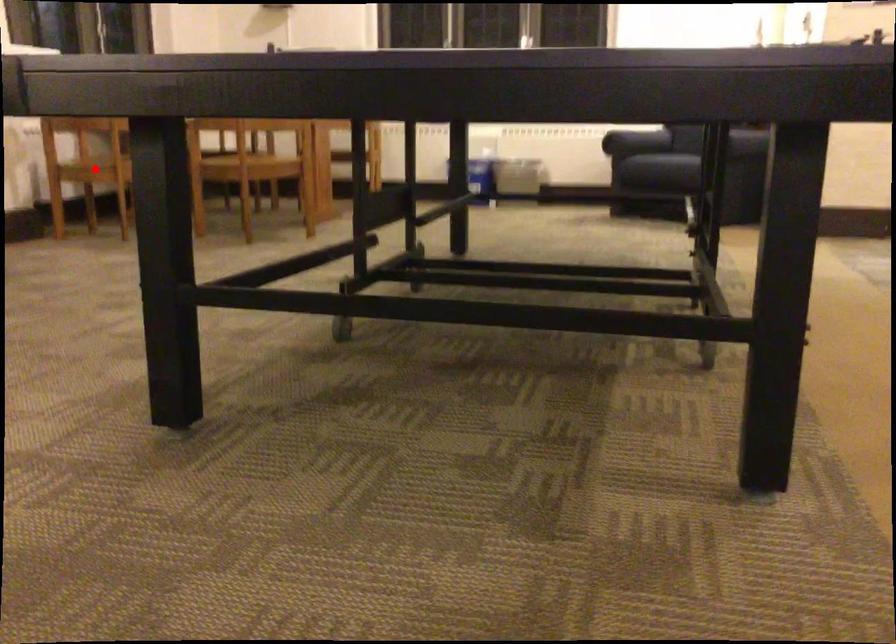
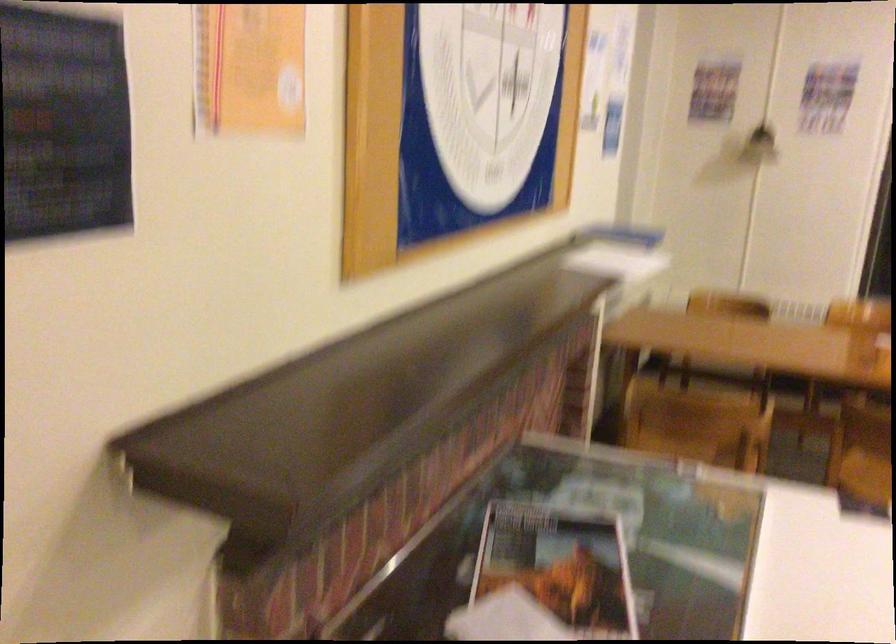
Question: I am providing you with two images of the same scene from different viewpoints. A red point is marked on the first image. Can you still see the location of the red point in image 2?

Choices:
 (A) Yes
 (B) No

Answer: (B)